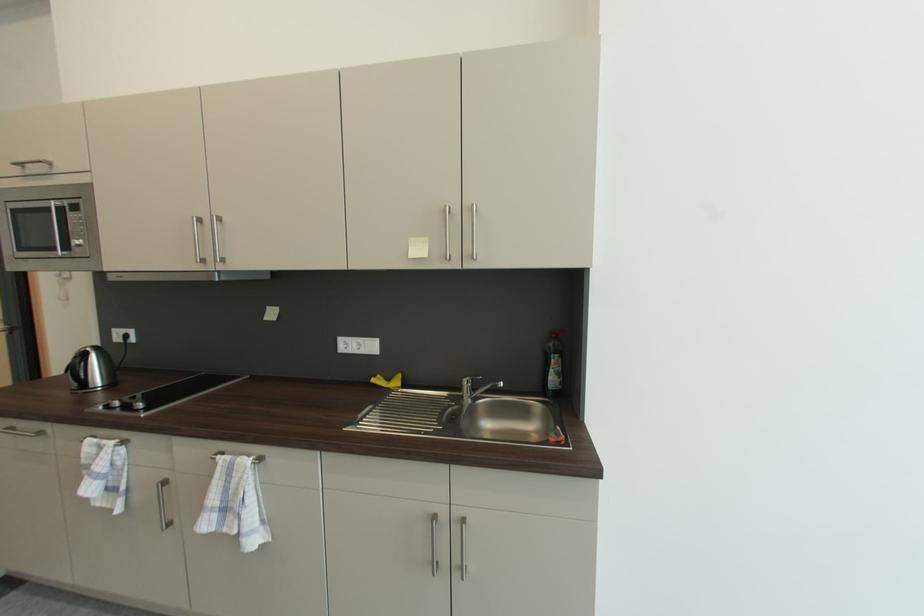
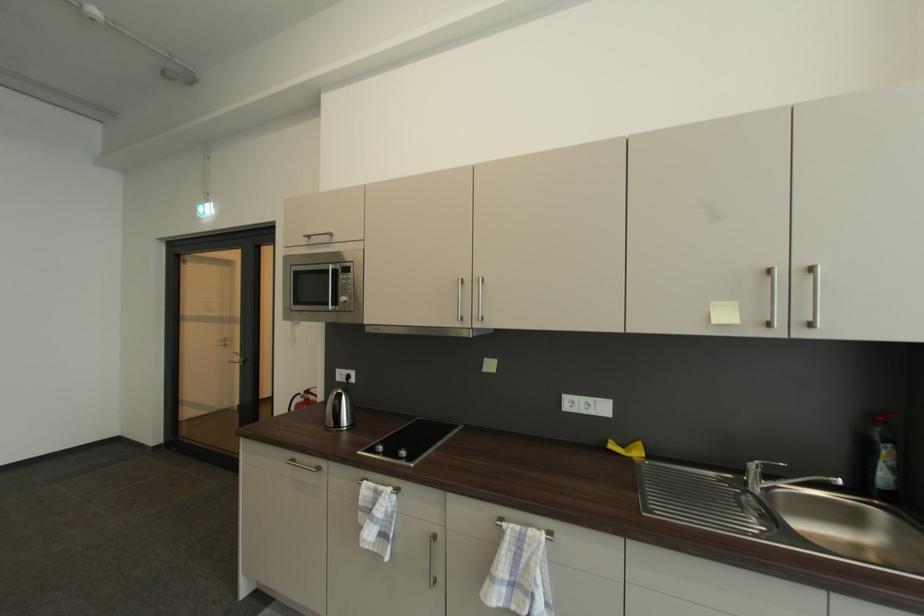
Question: What movement of the cameraman would produce the second image?

Choices:
 (A) Left
 (B) Right
 (C) Forward
 (D) Backward

Answer: (A)